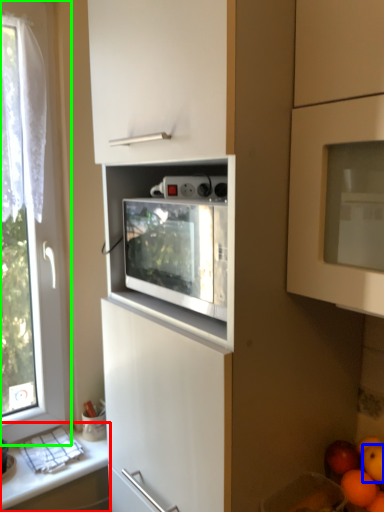
Question: Based on their relative distances, which object is farther from countertop (highlighted by a red box)? Choose from orange (highlighted by a blue box) and window (highlighted by a green box).

Choices:
 (A) orange
 (B) window

Answer: (A)